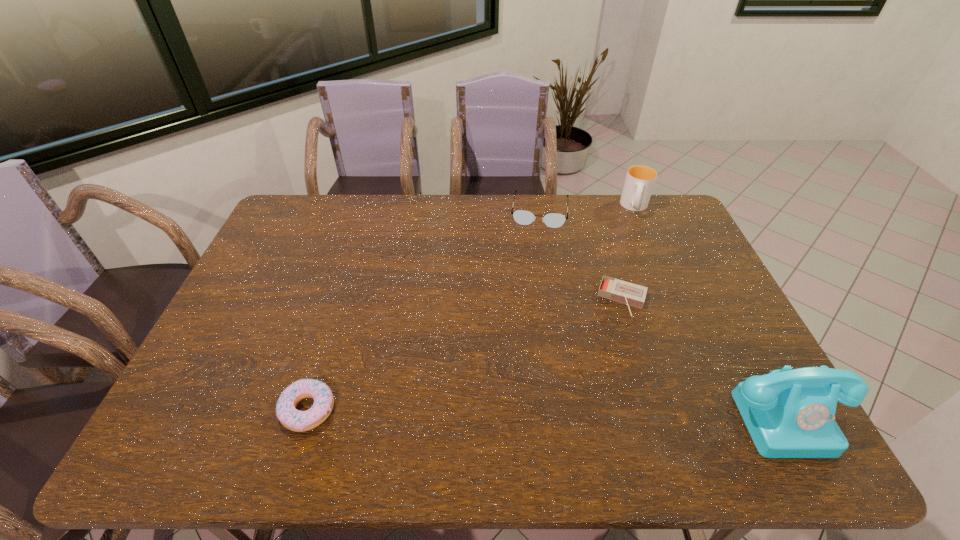
Where is `vacant area situated on the striking surface of the third farthest object`? vacant area situated on the striking surface of the third farthest object is located at coordinates (594, 401).

At what (x,y) coordinates should I click in order to perform the action: click on free location located on the striking surface of the third farthest object. Please return your answer as a coordinate pair (x, y). Looking at the image, I should click on (597, 391).

At what (x,y) coordinates should I click in order to perform the action: click on free location located on the lenses of the second object from left to right. Please return your answer as a coordinate pair (x, y). Image resolution: width=960 pixels, height=540 pixels. Looking at the image, I should click on (535, 261).

This screenshot has width=960, height=540. Find the location of `free point located on the lenses of the second object from left to right`. free point located on the lenses of the second object from left to right is located at coordinates (534, 267).

This screenshot has width=960, height=540. What are the coordinates of `vacant space located on the lenses of the second object from left to right` in the screenshot? It's located at (530, 298).

Find the location of a particular element. vacant space situated with the handle on the side of the second tallest object is located at coordinates (631, 280).

Where is `free space located with the handle on the side of the second tallest object`? The height and width of the screenshot is (540, 960). free space located with the handle on the side of the second tallest object is located at coordinates (631, 278).

Where is `free region located 0.180m with the handle on the side of the second tallest object`? The height and width of the screenshot is (540, 960). free region located 0.180m with the handle on the side of the second tallest object is located at coordinates (634, 250).

Identify the location of spectacles present at the far edge. This screenshot has height=540, width=960. (523, 217).

The image size is (960, 540). I want to click on cup at the far edge, so click(x=640, y=180).